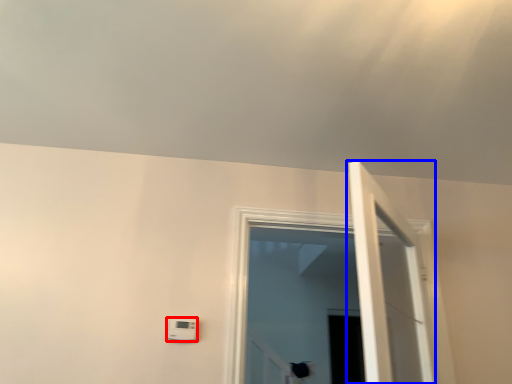
Question: Which point is closer to the camera, light switch (highlighted by a red box) or door (highlighted by a blue box)?

Choices:
 (A) light switch
 (B) door

Answer: (B)